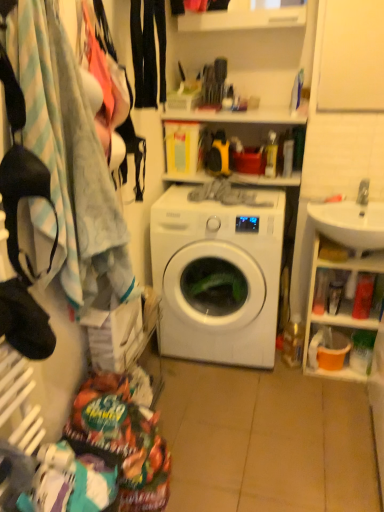
Image resolution: width=384 pixels, height=512 pixels. Find the location of `free space in front of white glossy washing machine at center`. free space in front of white glossy washing machine at center is located at coordinates (246, 411).